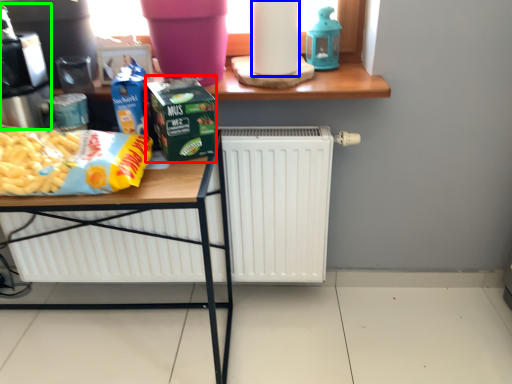
Question: Which is farther away from carton (highlighted by a red box)? paper towel (highlighted by a blue box) or coffee machine (highlighted by a green box)?

Choices:
 (A) paper towel
 (B) coffee machine

Answer: (B)